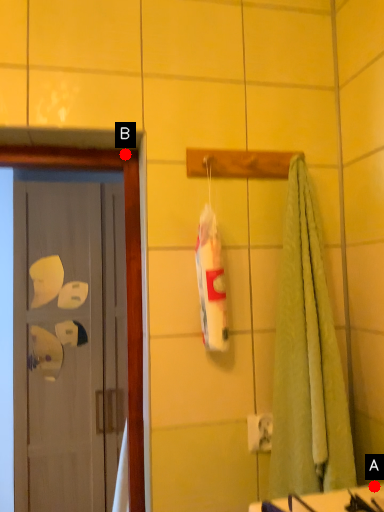
Question: Two points are circled on the image, labeled by A and B beside each circle. Which of the following is the closest to the observer?

Choices:
 (A) A is closer
 (B) B is closer

Answer: (A)